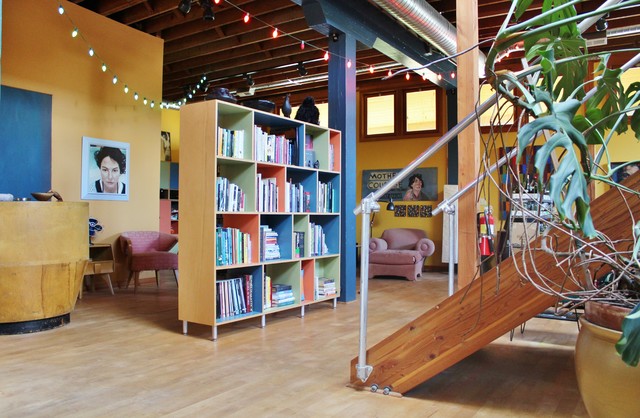
In order to click on shadows under stairs in this screenshot , I will do `click(513, 383)`.